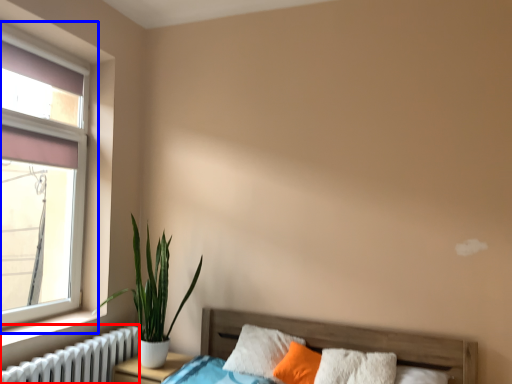
Question: Which point is further to the camera, radiator (highlighted by a red box) or window (highlighted by a blue box)?

Choices:
 (A) radiator
 (B) window

Answer: (B)